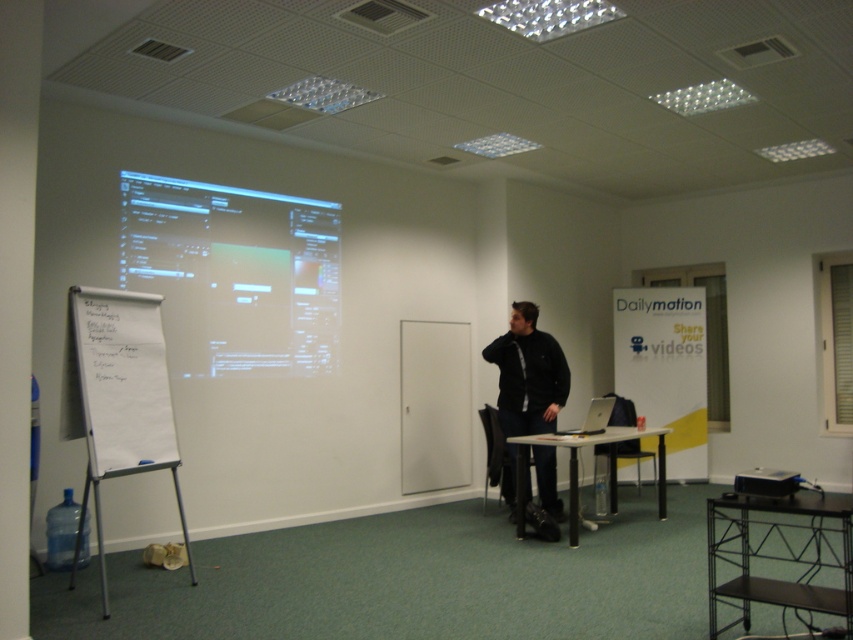
You are standing in the conference room and want to place a 1.2 meter wide laptop on the table at point (781, 556). Can the table accommodate the laptop?

The black metal table at lower right has a width of 1.2 meters, so the laptop can fit on it.

You are organizing a small meeting in the conference room and need to place a laptop on the largest available surface. Which object between the black metal table at lower right and the white paper at left should you choose?

The black metal table at lower right is bigger than the white paper at left, so you should place the laptop on the black metal table at lower right.